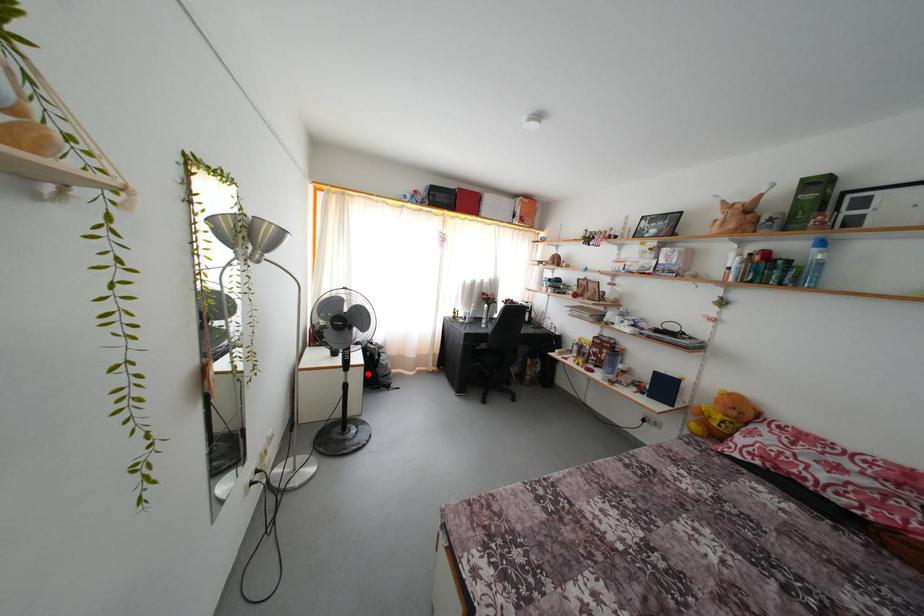
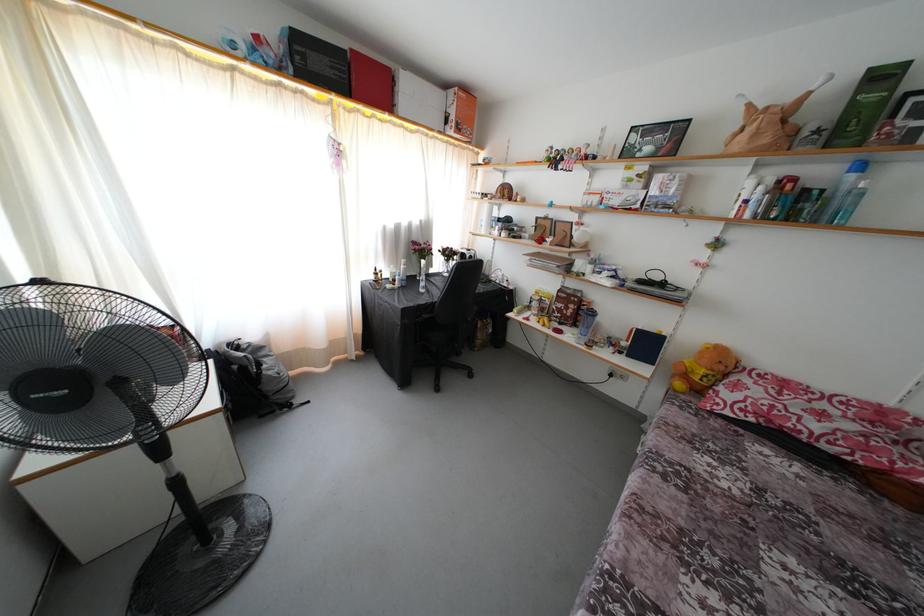
The point at the highlighted location is marked in the first image. Where is the corresponding point in the second image?

(225, 421)